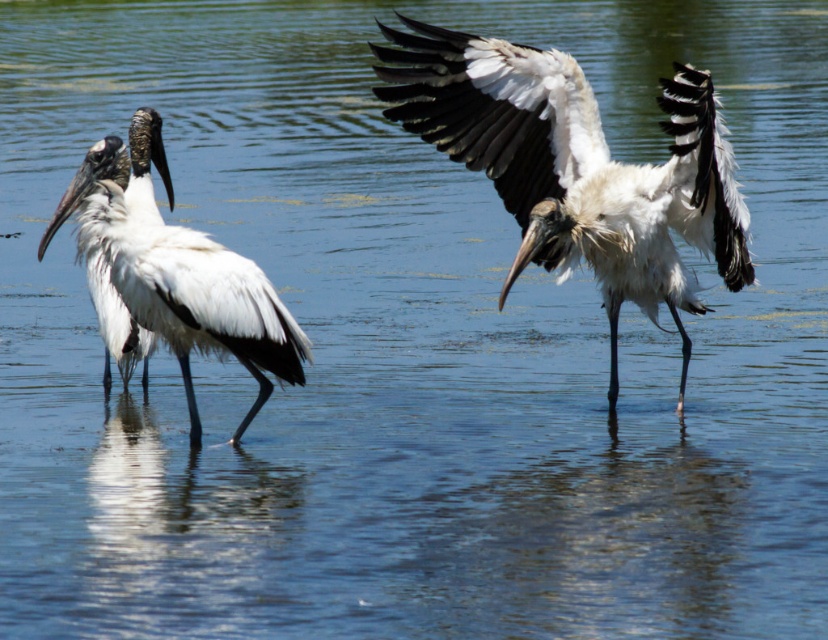
Is white matte bird at center smaller than white matte bird at left?

Actually, white matte bird at center might be larger than white matte bird at left.

Who is more forward, (451, 77) or (111, 257)?

Point (111, 257)

Is point (662, 216) in front of point (188, 241)?

No, it is not.

Find the location of `white matte bird at center`. white matte bird at center is located at coordinates (576, 168).